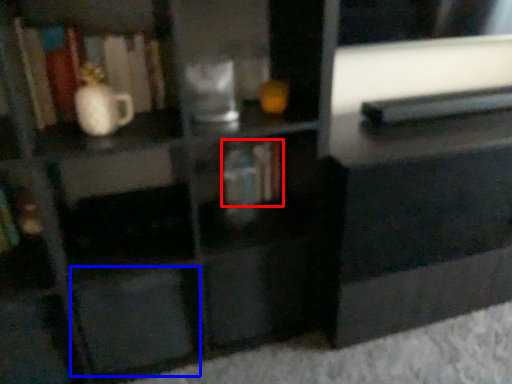
Question: Which object appears closest to the camera in this image, book (highlighted by a red box) or drawer (highlighted by a blue box)?

Choices:
 (A) book
 (B) drawer

Answer: (B)